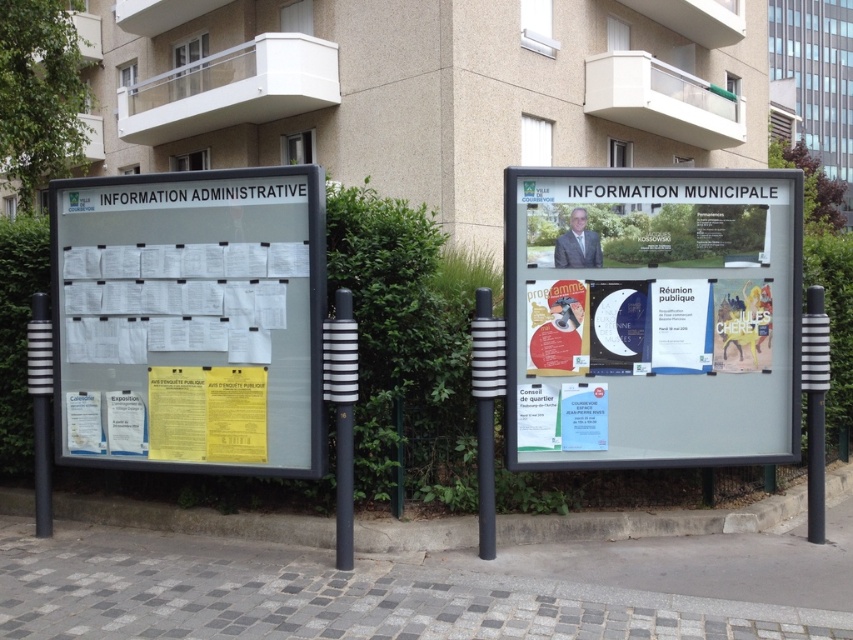
You are a gardener who needs to place a new sign that is 1.2 meters wide. You have two options for placement near the white plastic board at center and the green leafy hedge at left. Based on their sizes, which location would be more suitable for the sign?

The green leafy hedge at left is larger than the white plastic board at center. Since the sign is 1.2 meters wide, placing it near the green leafy hedge at left would be more suitable as there is more space available compared to the smaller white plastic board at center.